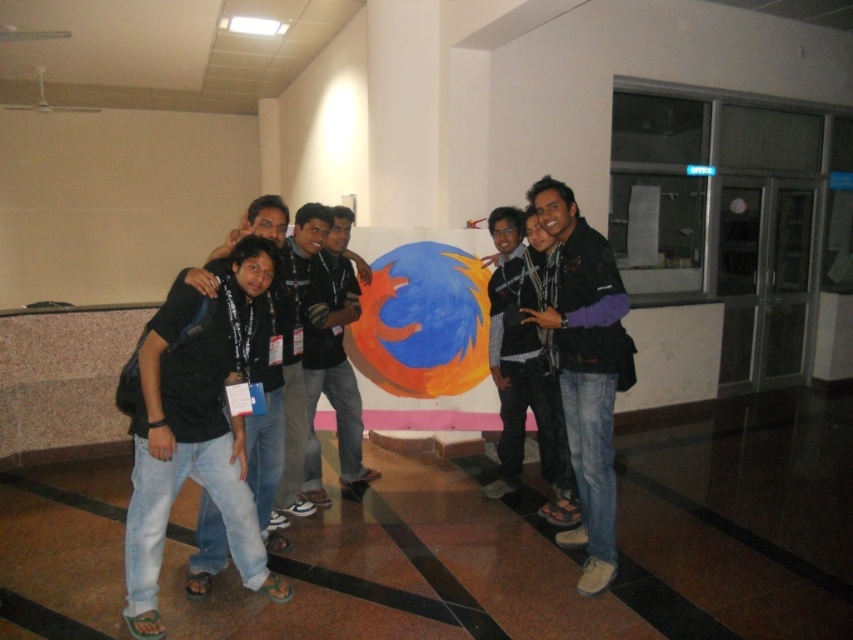
Question: Estimate the real-world distances between objects in this image. Which object is closer to the matte black shirt at center?

Choices:
 (A) denim jeans at center
 (B) jeans at center
 (C) black matte shirt at center
 (D) purple fleece jacket at center

Answer: (C)

Question: From the image, what is the correct spatial relationship of denim jeans at center in relation to black matte shirt at center?

Choices:
 (A) above
 (B) below

Answer: (B)

Question: Estimate the real-world distances between objects in this image. Which object is closer to the jeans at center?

Choices:
 (A) matte black shirt at center
 (B) denim jeans at center
 (C) purple fleece jacket at center

Answer: (C)

Question: Does purple fleece jacket at center have a greater width compared to black matte shirt at center?

Choices:
 (A) no
 (B) yes

Answer: (A)

Question: Can you confirm if black matte shirt at center is thinner than matte black shirt at center?

Choices:
 (A) no
 (B) yes

Answer: (A)

Question: Which of the following is the closest to the observer?

Choices:
 (A) (573, 476)
 (B) (518, 396)
 (C) (308, 374)
 (D) (163, 525)

Answer: (D)